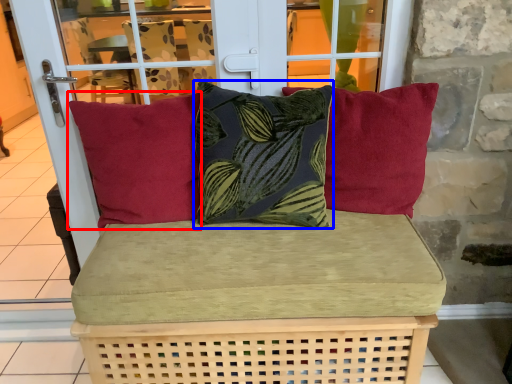
Question: Which point is closer to the camera, pillow (highlighted by a red box) or pillow (highlighted by a blue box)?

Choices:
 (A) pillow
 (B) pillow

Answer: (B)